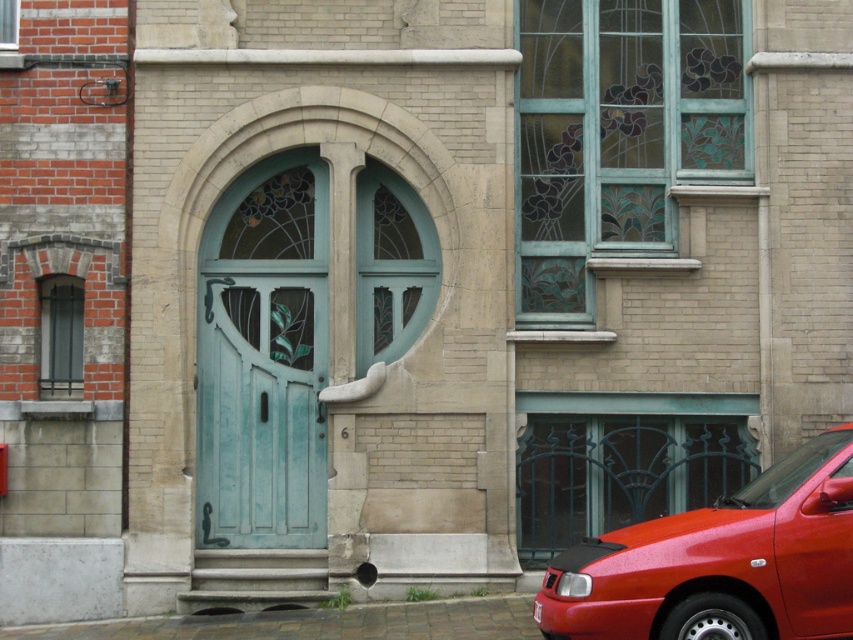
Who is more distant from viewer, (827, 540) or (252, 339)?

Point (252, 339)

Looking at this image, who is more distant from viewer, (614, 552) or (202, 422)?

Positioned behind is point (202, 422).

Where is `shiny red car at lower right`? shiny red car at lower right is located at coordinates (720, 563).